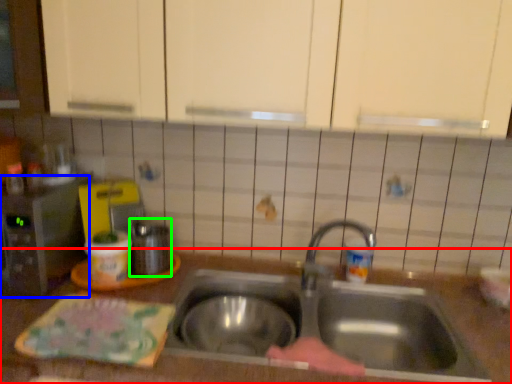
Question: Estimate the real-world distances between objects in this image. Which object is closer to countertop (highlighted by a red box), appliance (highlighted by a blue box) or appliance (highlighted by a green box)?

Choices:
 (A) appliance
 (B) appliance

Answer: (A)